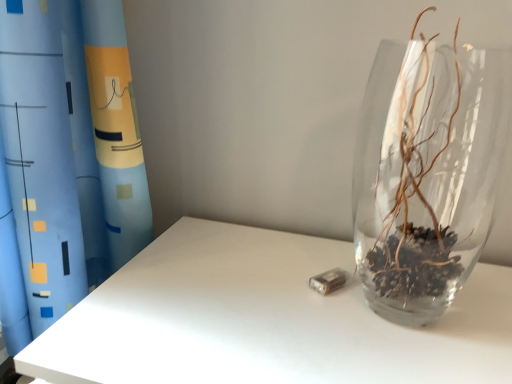
Question: Is blue fabric curtain at upper left to the right of transparent glass vase at right from the viewer's perspective?

Choices:
 (A) no
 (B) yes

Answer: (A)

Question: Is blue fabric curtain at upper left completely or partially outside of transparent glass vase at right?

Choices:
 (A) yes
 (B) no

Answer: (A)

Question: From the image's perspective, would you say blue fabric curtain at upper left is shown under transparent glass vase at right?

Choices:
 (A) no
 (B) yes

Answer: (A)

Question: Considering the relative sizes of blue fabric curtain at upper left and transparent glass vase at right in the image provided, is blue fabric curtain at upper left thinner than transparent glass vase at right?

Choices:
 (A) no
 (B) yes

Answer: (A)

Question: Would you consider blue fabric curtain at upper left to be distant from transparent glass vase at right?

Choices:
 (A) no
 (B) yes

Answer: (A)

Question: From a real-world perspective, is blue fabric curtain at upper left under transparent glass vase at right?

Choices:
 (A) yes
 (B) no

Answer: (A)

Question: Considering the relative sizes of transparent glass vase at right and blue fabric curtain at upper left in the image provided, is transparent glass vase at right smaller than blue fabric curtain at upper left?

Choices:
 (A) yes
 (B) no

Answer: (A)

Question: Is transparent glass vase at right oriented away from blue fabric curtain at upper left?

Choices:
 (A) no
 (B) yes

Answer: (A)

Question: Is transparent glass vase at right surrounding blue fabric curtain at upper left?

Choices:
 (A) no
 (B) yes

Answer: (A)

Question: Is the position of transparent glass vase at right more distant than that of blue fabric curtain at upper left?

Choices:
 (A) yes
 (B) no

Answer: (A)

Question: From a real-world perspective, is transparent glass vase at right under blue fabric curtain at upper left?

Choices:
 (A) no
 (B) yes

Answer: (A)

Question: Can you confirm if transparent glass vase at right is shorter than blue fabric curtain at upper left?

Choices:
 (A) no
 (B) yes

Answer: (B)

Question: From a real-world perspective, is blue fabric curtain at upper left above or below transparent glass vase at right?

Choices:
 (A) above
 (B) below

Answer: (B)